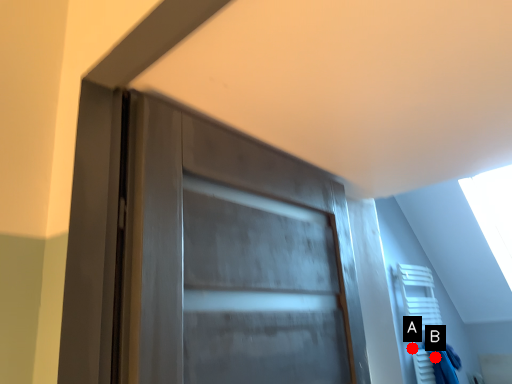
Question: Two points are circled on the image, labeled by A and B beside each circle. Which point is closer to the camera?

Choices:
 (A) A is closer
 (B) B is closer

Answer: (B)